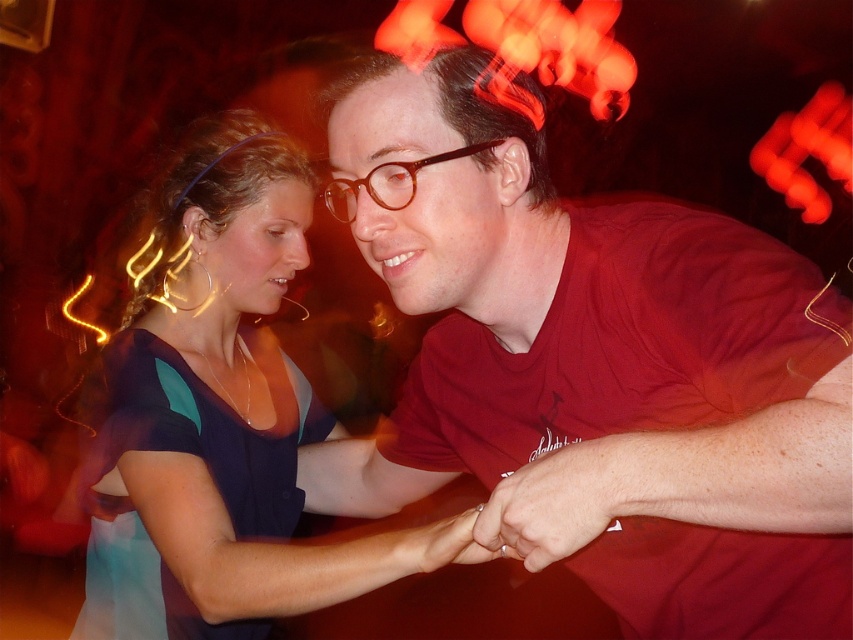
You are at a party and want to take a photo of the two dance partners. The first point, point (468, 337), is on the man, and the second point, point (265, 566), is on the woman. Which point should you focus on to ensure the man is in focus?

You should focus on point (468, 337) because it is closer to the camera than point (265, 566), ensuring the man is in focus.

You are a photographer at the party and want to take a photo of the matte blue dress at center and the brown glossy glasses at center. Which object should you focus on first if you want to capture both in sharp focus?

The matte blue dress at center is taller than the brown glossy glasses at center. To capture both in sharp focus, focus on the matte blue dress at center since it is the larger object and requires more detailed focus.

You are at a party and want to take a photo of both the matte red shirt at center and the matte blue dress at center. Which one should you focus on first to ensure both are in focus?

You should focus on the matte red shirt at center first because it is closer to the viewer than the matte blue dress at center. By focusing on the closer object, the depth of field may extend to include the farther one as well, ensuring both are in focus.